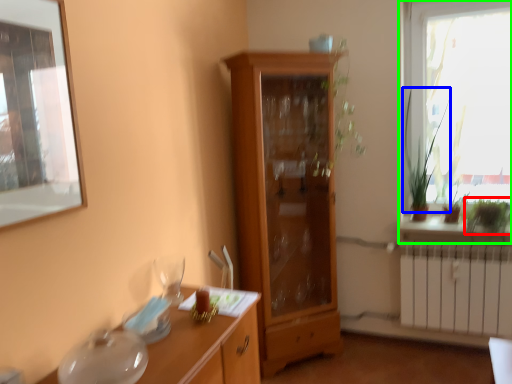
Question: Which object is positioned farthest from plant (highlighted by a red box)? Select from plant (highlighted by a blue box) and window (highlighted by a green box).

Choices:
 (A) plant
 (B) window

Answer: (B)